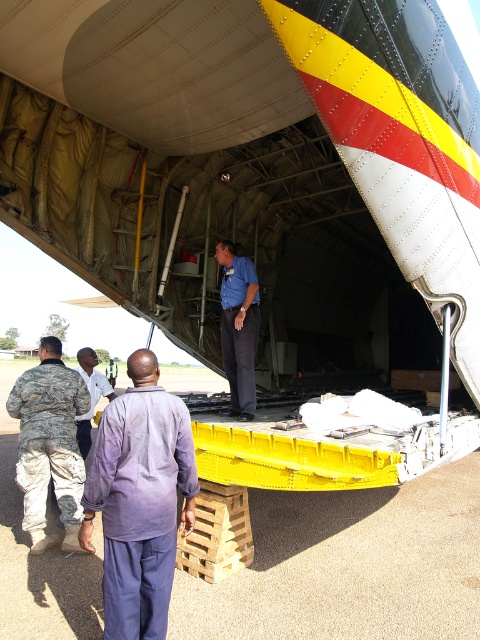
You are observing an aircraft cargo hold scene. You notice two people inside the cargo hold wearing a purple cotton shirt at center and a blue shirt at center. Which of these two shirts is worn by a shorter person?

The purple cotton shirt at center is worn by a shorter person compared to the blue shirt at center.

You are a safety inspector at the airfield. You need to ensure that two workers are at least 1 meter apart for safety. Are the camouflage fabric uniform at left and light purple shirt at center meeting the safety distance requirement?

The camouflage fabric uniform at left is 84.67 centimeters from light purple shirt at center. Since 84.67 cm is less than 1 meter, they are not meeting the safety distance requirement.

You are an airport security officer checking the cargo hold of the aircraft. You notice two people inside the cargo hold area. One is wearing a purple cotton shirt at center and the other a blue shirt at center. According to the safety protocols, all personnel must be positioned to the right side of the cargo hold. Is the current positioning of both individuals compliant with this requirement?

The purple cotton shirt at center is to the left of the blue shirt at center, so the purple cotton shirt at center is not positioned to the right side of the cargo hold. The blue shirt at center is positioned to the right of the purple cotton shirt at center, but it is unclear if it meets the requirement to be on the right side of the cargo hold overall. Further clarification on the cargo hold layout is needed to determine full compliance.